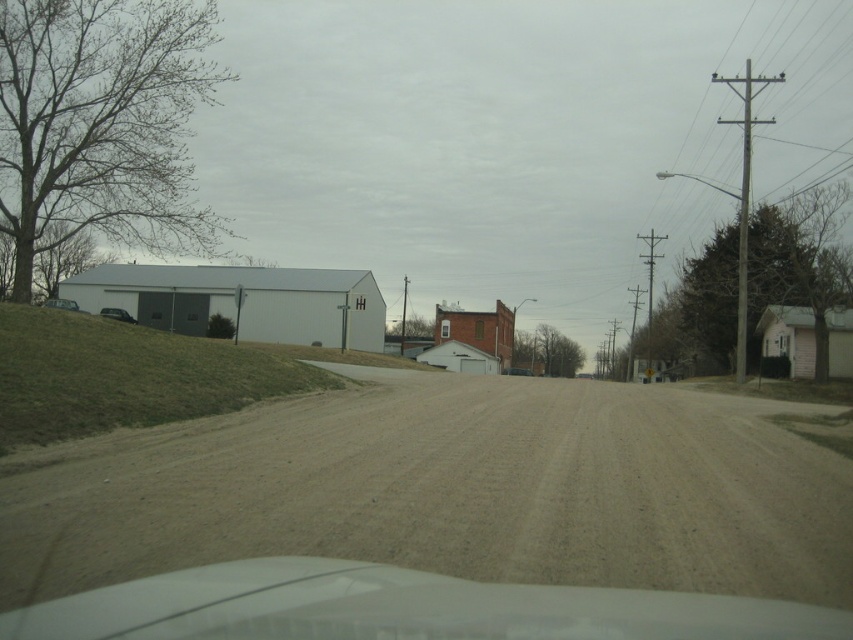
Can you confirm if brown sandy dirt track at center is shorter than matte black car at left?

Yes.

Does point (776, 468) lie behind point (125, 308)?

No, it is in front of (125, 308).

This screenshot has height=640, width=853. I want to click on brown sandy dirt track at center, so point(448,490).

Can you confirm if matte black car at left is shorter than matte gray car at left?

Yes.

Does matte black car at left have a greater height compared to matte gray car at left?

In fact, matte black car at left may be shorter than matte gray car at left.

Describe the element at coordinates (117, 314) in the screenshot. I see `matte black car at left` at that location.

This screenshot has height=640, width=853. Find the location of `matte black car at left`. matte black car at left is located at coordinates (117, 314).

Is brown sandy dirt track at center further to camera compared to matte gray car at left?

No, brown sandy dirt track at center is in front of matte gray car at left.

Is brown sandy dirt track at center positioned before matte gray car at left?

Yes.

Find the location of a particular element. The height and width of the screenshot is (640, 853). brown sandy dirt track at center is located at coordinates (448, 490).